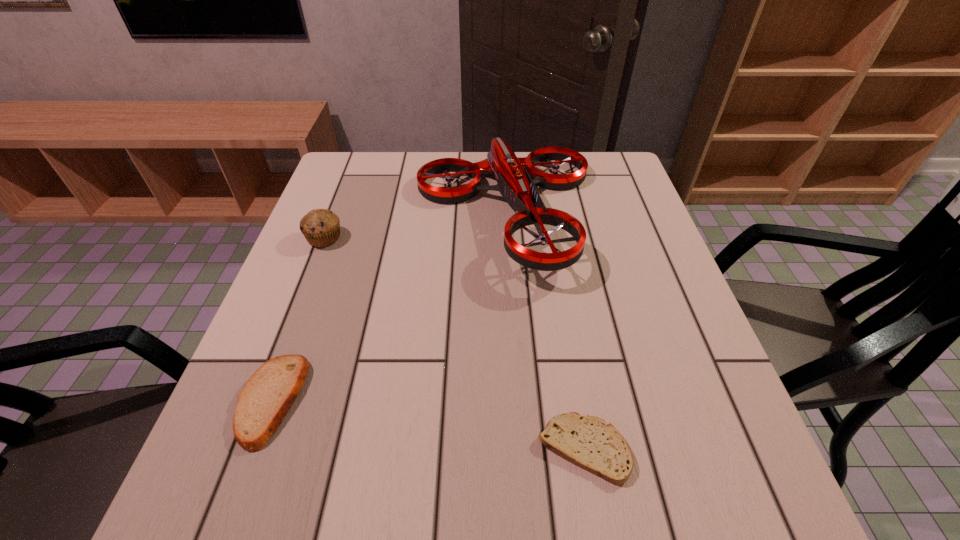
Choose which object is the third nearest neighbor to the shorter pita bread. Please provide its 2D coordinates. Your answer should be formatted as a tuple, i.e. [(x, y)], where the tuple contains the x and y coordinates of a point satisfying the conditions above.

[(321, 227)]

The width and height of the screenshot is (960, 540). I want to click on the third closest object relative to the right pita bread, so click(321, 227).

I want to click on free space that satisfies the following two spatial constraints: 1. on the front side of the left pita bread; 2. on the right side of the shortest object, so click(x=254, y=448).

Locate an element on the screen. The width and height of the screenshot is (960, 540). free spot that satisfies the following two spatial constraints: 1. on the front side of the muffin; 2. on the right side of the second shortest object is located at coordinates (261, 400).

This screenshot has height=540, width=960. Identify the location of free location that satisfies the following two spatial constraints: 1. on the front side of the third tallest object; 2. on the right side of the shorter pita bread. (254, 448).

Identify the location of free space that satisfies the following two spatial constraints: 1. on the back side of the tallest object; 2. on the right side of the muffin. (333, 213).

What are the coordinates of `free spot that satisfies the following two spatial constraints: 1. on the back side of the drone; 2. on the right side of the second tallest object` in the screenshot? It's located at (333, 213).